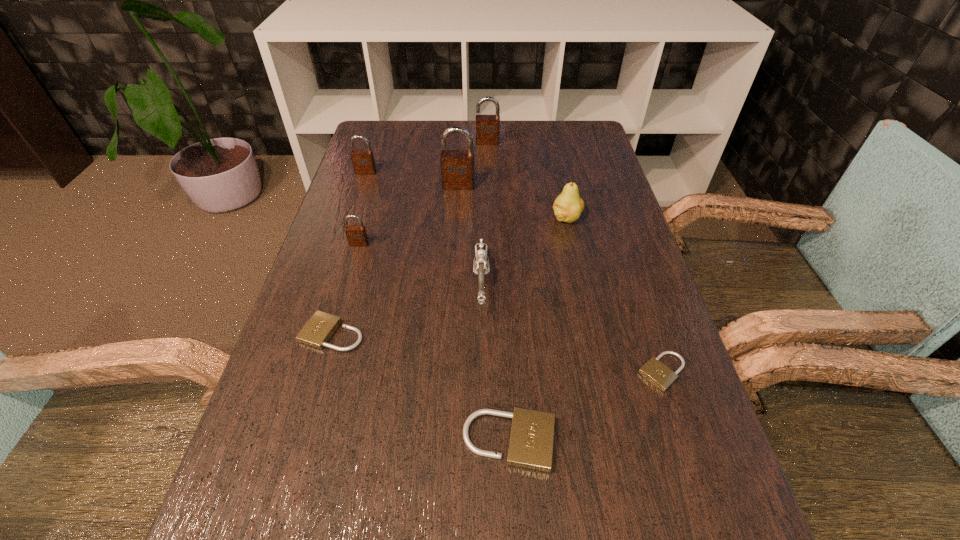
Identify the location of vacant position in the image that satisfies the following two spatial constraints: 1. aimed along the barrel of the gun; 2. on the right side of the biggest beige padlock. This screenshot has height=540, width=960. (482, 441).

You are a GUI agent. You are given a task and a screenshot of the screen. Output one action in this format:
    pyautogui.click(x=<x>, y=<y>)
    Task: Click on the free location that satisfies the following two spatial constraints: 1. on the front-facing side of the second nearest brown padlock; 2. on the left side of the smallest beige padlock
    The width and height of the screenshot is (960, 540).
    Given the screenshot: What is the action you would take?
    pyautogui.click(x=447, y=372)

The height and width of the screenshot is (540, 960). I want to click on blank area in the image that satisfies the following two spatial constraints: 1. on the front-facing side of the nearest object; 2. on the right side of the third brown padlock from left to right, so (x=444, y=441).

Locate an element on the screen. vacant area that satisfies the following two spatial constraints: 1. on the front-facing side of the second object from right to left; 2. on the left side of the seventh nearest object is located at coordinates (457, 218).